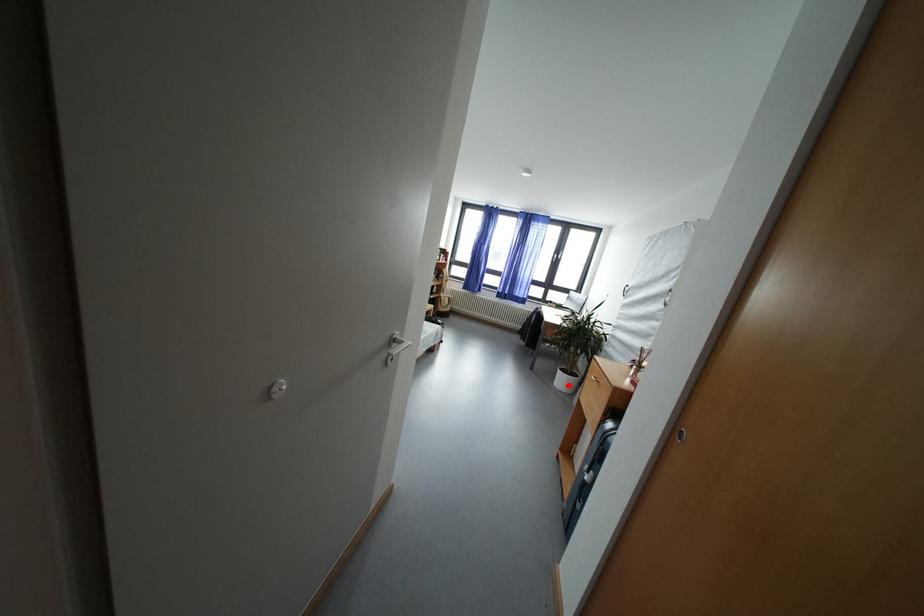
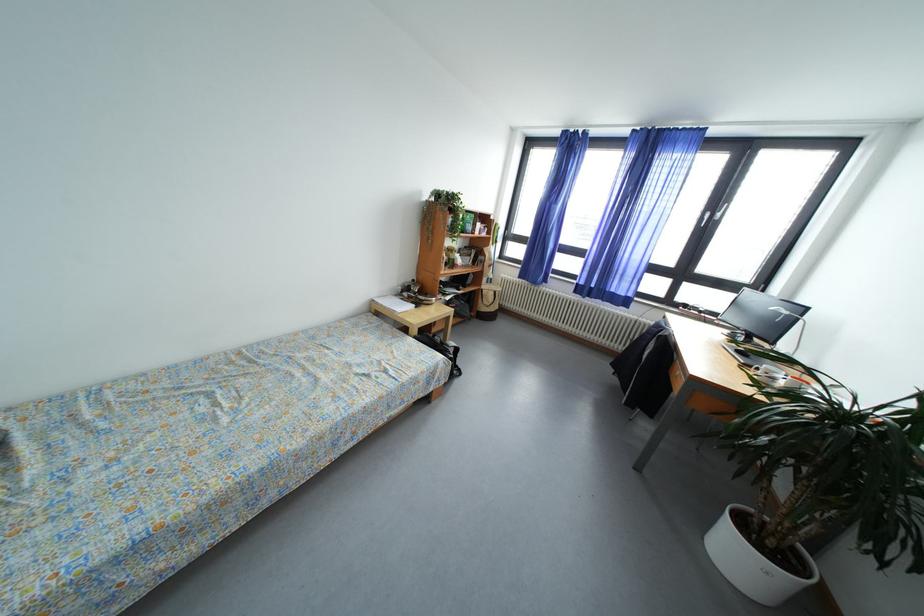
Locate, in the second image, the point that corresponds to the highlighted location in the first image.

(745, 561)